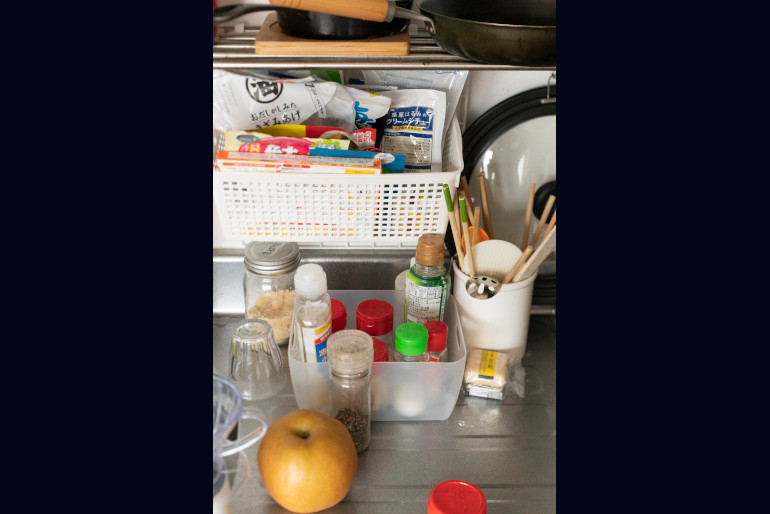
Locate an element on the screen. pot lid, brown and white is located at coordinates (491, 122).